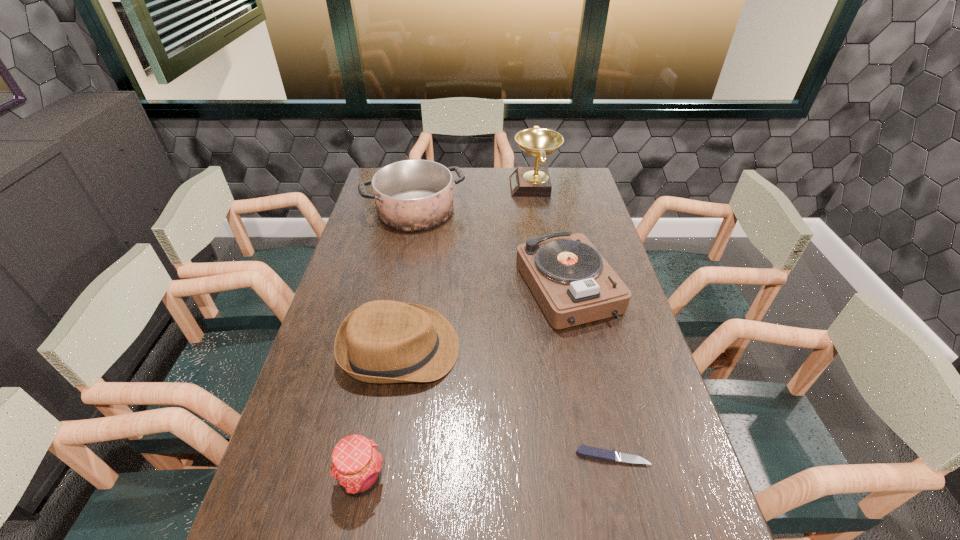
Where is `vacant space located on the back of the record player`? The image size is (960, 540). vacant space located on the back of the record player is located at coordinates (550, 202).

Locate an element on the screen. This screenshot has width=960, height=540. free space located on the front-facing side of the fedora is located at coordinates (498, 349).

Find the location of a particular element. free location located 0.130m on the back of the jam is located at coordinates (376, 403).

At what (x,y) coordinates should I click in order to perform the action: click on vacant space located 0.180m on the back of the steak knife. Please return your answer as a coordinate pair (x, y). Looking at the image, I should click on (595, 381).

The width and height of the screenshot is (960, 540). I want to click on award that is at the far edge, so click(535, 181).

This screenshot has height=540, width=960. What are the coordinates of `saucepan situated at the far edge` in the screenshot? It's located at (412, 195).

Identify the location of saucepan positioned at the left edge. This screenshot has height=540, width=960. (412, 195).

At what (x,y) coordinates should I click in order to perform the action: click on fedora at the left edge. Please return your answer as a coordinate pair (x, y). This screenshot has width=960, height=540. Looking at the image, I should click on (383, 341).

Locate an element on the screen. The width and height of the screenshot is (960, 540). jam positioned at the left edge is located at coordinates (356, 466).

Locate an element on the screen. award located at the right edge is located at coordinates (535, 181).